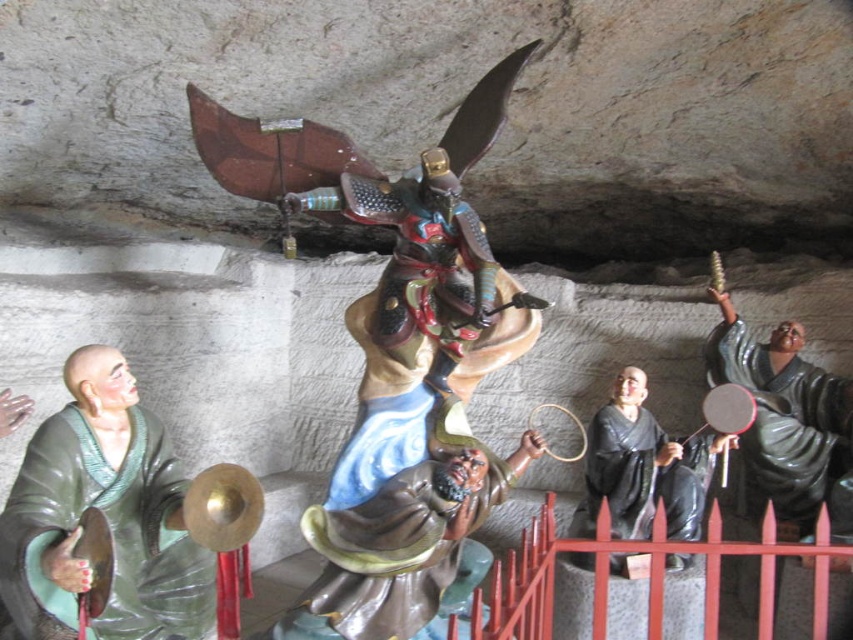
Who is higher up, shiny bronze warrior at center or green matte monk statue at left?

shiny bronze warrior at center

Which is in front, point (422, 378) or point (74, 349)?

Point (422, 378) is more forward.

Between point (422, 177) and point (76, 400), which one is positioned behind?

Positioned behind is point (422, 177).

Image resolution: width=853 pixels, height=640 pixels. I want to click on shiny bronze warrior at center, so click(x=399, y=365).

Who is positioned more to the left, smooth brown statue at center or black glossy monk at center?

Positioned to the left is smooth brown statue at center.

Does smooth brown statue at center appear on the left side of black glossy monk at center?

Correct, you'll find smooth brown statue at center to the left of black glossy monk at center.

Does point (427, 452) come in front of point (624, 509)?

Yes, it is in front of point (624, 509).

At what (x,y) coordinates should I click in order to perform the action: click on smooth brown statue at center. Please return your answer as a coordinate pair (x, y). The width and height of the screenshot is (853, 640). Looking at the image, I should click on (405, 540).

Is green matte monk statue at left to the right of red metal fence at lower center from the viewer's perspective?

Incorrect, green matte monk statue at left is not on the right side of red metal fence at lower center.

Identify the location of green matte monk statue at left. (105, 515).

Is point (74, 500) closer to camera compared to point (590, 540)?

That is True.

You are a GUI agent. You are given a task and a screenshot of the screen. Output one action in this format:
    pyautogui.click(x=<x>, y=<y>)
    Task: Click on the green matte monk statue at left
    
    Given the screenshot: What is the action you would take?
    (105, 515)